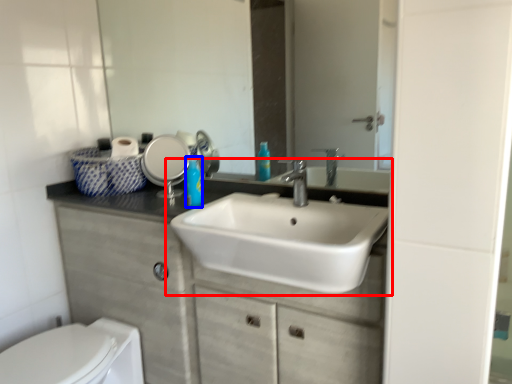
Question: Which point is closer to the camera, sink (highlighted by a red box) or soap dispenser (highlighted by a blue box)?

Choices:
 (A) sink
 (B) soap dispenser

Answer: (A)